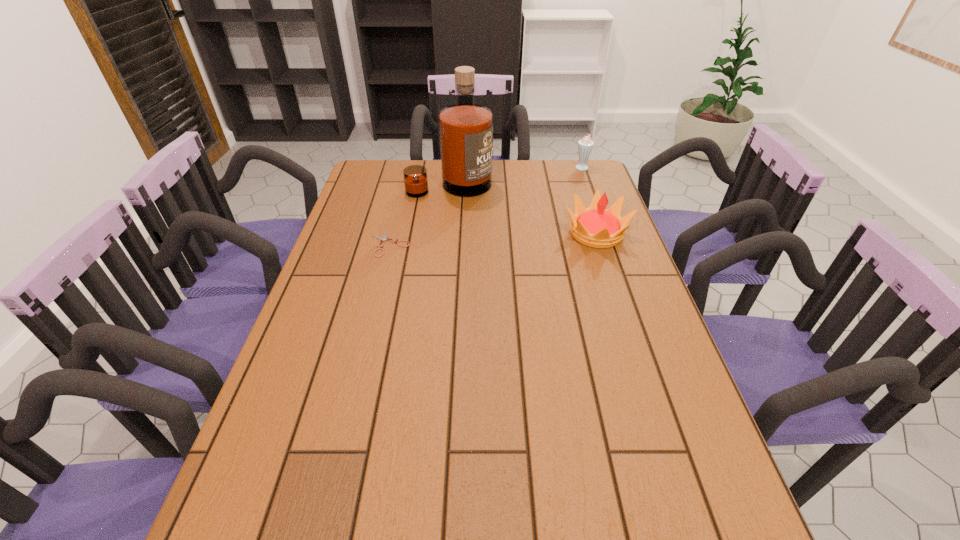
The height and width of the screenshot is (540, 960). I want to click on free space that satisfies the following two spatial constraints: 1. on the back side of the crown; 2. on the right side of the milkshake, so click(575, 167).

Image resolution: width=960 pixels, height=540 pixels. In order to click on vacant area in the image that satisfies the following two spatial constraints: 1. on the back side of the shortest object; 2. on the left side of the crown in this screenshot , I will do `click(393, 233)`.